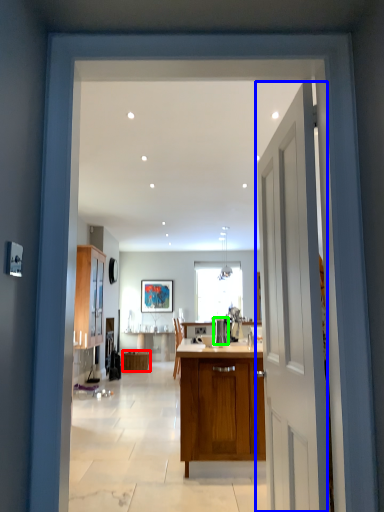
Question: Which is farther away from cabinetry (highlighted by a red box)? door (highlighted by a blue box) or appliance (highlighted by a green box)?

Choices:
 (A) door
 (B) appliance

Answer: (A)